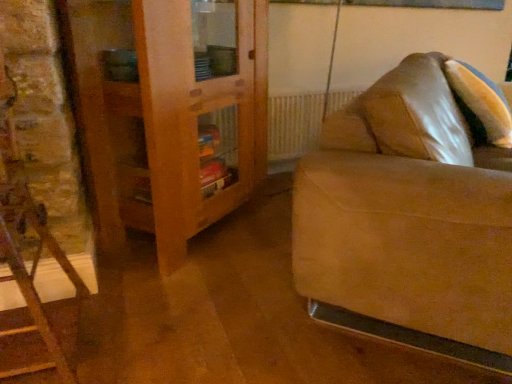
Question: Is wooden cabinet at left closer to camera compared to suede couch at right?

Choices:
 (A) yes
 (B) no

Answer: (B)

Question: Is wooden cabinet at left bigger than suede couch at right?

Choices:
 (A) no
 (B) yes

Answer: (A)

Question: Can you confirm if wooden cabinet at left is smaller than suede couch at right?

Choices:
 (A) yes
 (B) no

Answer: (A)

Question: Does wooden cabinet at left have a lesser height compared to suede couch at right?

Choices:
 (A) yes
 (B) no

Answer: (B)

Question: Is suede couch at right at the back of wooden cabinet at left?

Choices:
 (A) yes
 (B) no

Answer: (B)

Question: From the image's perspective, is wooden cabinet at left over suede couch at right?

Choices:
 (A) no
 (B) yes

Answer: (B)

Question: From a real-world perspective, is suede couch at right below wooden cabinet at left?

Choices:
 (A) yes
 (B) no

Answer: (A)

Question: Is suede couch at right positioned far away from wooden cabinet at left?

Choices:
 (A) no
 (B) yes

Answer: (A)

Question: Considering the relative sizes of suede couch at right and wooden cabinet at left in the image provided, is suede couch at right wider than wooden cabinet at left?

Choices:
 (A) yes
 (B) no

Answer: (A)

Question: From a real-world perspective, is suede couch at right positioned over wooden cabinet at left based on gravity?

Choices:
 (A) no
 (B) yes

Answer: (A)

Question: From the image's perspective, is suede couch at right above wooden cabinet at left?

Choices:
 (A) no
 (B) yes

Answer: (A)

Question: Considering the relative positions of suede couch at right and wooden cabinet at left in the image provided, is suede couch at right to the right of wooden cabinet at left from the viewer's perspective?

Choices:
 (A) yes
 (B) no

Answer: (A)

Question: From the image's perspective, relative to suede couch at right, is wooden cabinet at left above or below?

Choices:
 (A) above
 (B) below

Answer: (A)